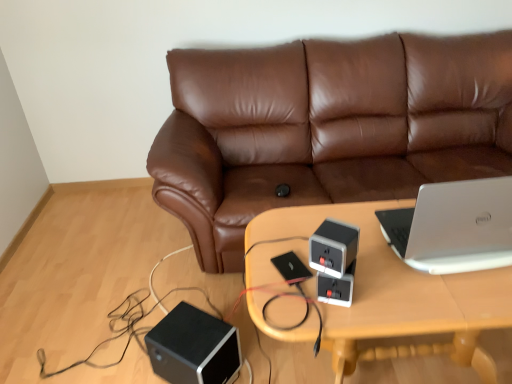
Question: Is black matte speaker at lower left, which ranks as the first speaker in bottom-to-top order, closer to camera compared to gray matte speaker at center, which is the 2th speaker in left-to-right order?

Choices:
 (A) yes
 (B) no

Answer: (B)

Question: From the image's perspective, is black matte speaker at lower left, marked as the first speaker in a left-to-right arrangement, on gray matte speaker at center, which is the 2th speaker in left-to-right order?

Choices:
 (A) no
 (B) yes

Answer: (A)

Question: Can you confirm if black matte speaker at lower left, marked as the first speaker in a left-to-right arrangement, is positioned to the left of gray matte speaker at center, which is the 1th speaker from top to bottom?

Choices:
 (A) yes
 (B) no

Answer: (A)

Question: Is gray matte speaker at center, which is counted as the second speaker, starting from the back, at the back of black matte speaker at lower left, acting as the 2th speaker starting from the right?

Choices:
 (A) yes
 (B) no

Answer: (B)

Question: Considering the relative sizes of black matte speaker at lower left, which ranks as the first speaker in bottom-to-top order, and gray matte speaker at center, which is the 1th speaker from top to bottom, in the image provided, is black matte speaker at lower left, which ranks as the first speaker in bottom-to-top order, wider than gray matte speaker at center, which is the 1th speaker from top to bottom,?

Choices:
 (A) no
 (B) yes

Answer: (B)

Question: Does point (464, 274) appear closer or farther from the camera than point (245, 81)?

Choices:
 (A) closer
 (B) farther

Answer: (A)

Question: Is wooden table at center taller or shorter than brown leather couch at center?

Choices:
 (A) tall
 (B) short

Answer: (B)

Question: From a real-world perspective, relative to brown leather couch at center, is wooden table at center vertically above or below?

Choices:
 (A) above
 (B) below

Answer: (B)

Question: Is wooden table at center in front of or behind brown leather couch at center in the image?

Choices:
 (A) behind
 (B) front

Answer: (B)

Question: Visually, is gray matte speaker at center, which ranks as the second speaker in bottom-to-top order, positioned to the left or to the right of silver metallic laptop at right?

Choices:
 (A) right
 (B) left

Answer: (B)

Question: Considering their positions, is gray matte speaker at center, which is the 2th speaker in left-to-right order, located in front of or behind silver metallic laptop at right?

Choices:
 (A) front
 (B) behind

Answer: (A)

Question: In terms of height, does gray matte speaker at center, which is the 1th speaker from top to bottom, look taller or shorter compared to silver metallic laptop at right?

Choices:
 (A) short
 (B) tall

Answer: (A)

Question: Considering the positions of gray matte speaker at center, marked as the first speaker in a right-to-left arrangement, and silver metallic laptop at right in the image, is gray matte speaker at center, marked as the first speaker in a right-to-left arrangement, bigger or smaller than silver metallic laptop at right?

Choices:
 (A) small
 (B) big

Answer: (A)

Question: Considering the positions of black matte speaker at lower left, placed as the second speaker when sorted from front to back, and brown leather couch at center in the image, is black matte speaker at lower left, placed as the second speaker when sorted from front to back, wider or thinner than brown leather couch at center?

Choices:
 (A) wide
 (B) thin

Answer: (B)

Question: Is black matte speaker at lower left, marked as the second speaker in a top-to-bottom arrangement, bigger or smaller than brown leather couch at center?

Choices:
 (A) big
 (B) small

Answer: (B)